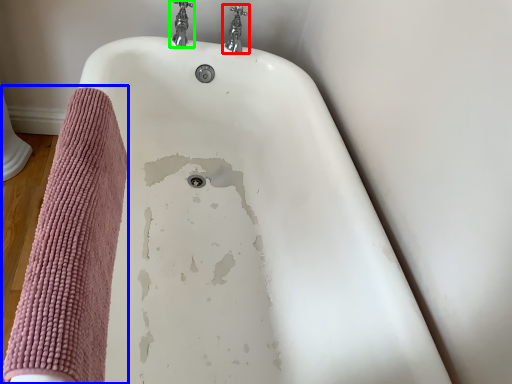
Question: Based on their relative distances, which object is nearer to tap (highlighted by a red box)? Choose from bath towel (highlighted by a blue box) and tap (highlighted by a green box).

Choices:
 (A) bath towel
 (B) tap

Answer: (B)